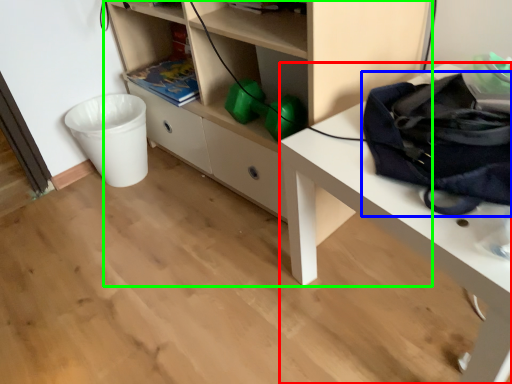
Question: Estimate the real-world distances between objects in this image. Which object is closer to desk (highlighted by a red box), messenger bag (highlighted by a blue box) or shelf (highlighted by a green box)?

Choices:
 (A) messenger bag
 (B) shelf

Answer: (A)